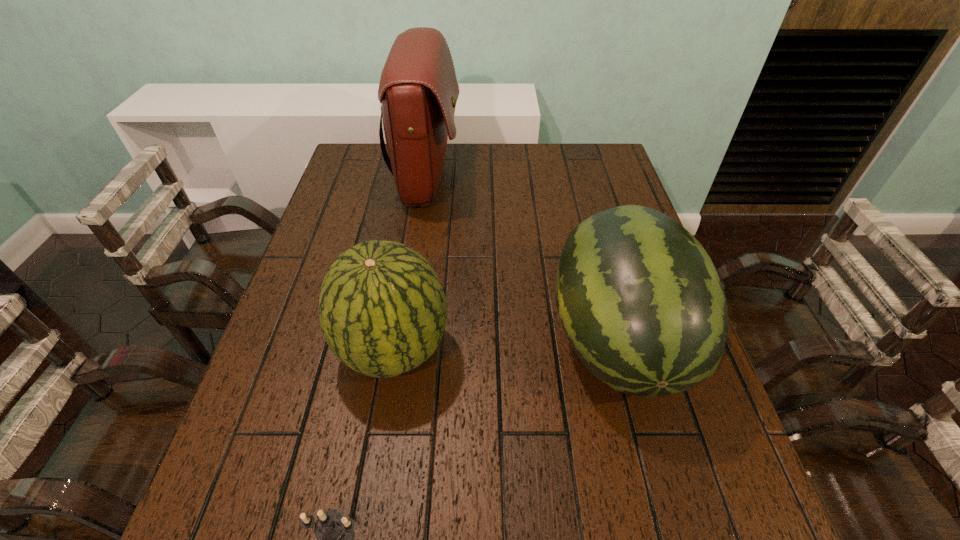
Where is `the tallest object`? The height and width of the screenshot is (540, 960). the tallest object is located at coordinates (418, 90).

At what (x,y) coordinates should I click in order to perform the action: click on the farthest object. Please return your answer as a coordinate pair (x, y). The height and width of the screenshot is (540, 960). Looking at the image, I should click on (418, 90).

Where is `the rightmost object`? the rightmost object is located at coordinates point(641,303).

Locate an element on the screen. the left watermelon is located at coordinates (382, 309).

This screenshot has height=540, width=960. In order to click on blank space located on the open flap of the tallest object in this screenshot , I will do `click(572, 178)`.

Identify the location of vacant area located on the front of the right watermelon. The image size is (960, 540). (654, 474).

I want to click on free location located 0.200m on the right of the left watermelon, so click(x=541, y=350).

Locate an element on the screen. Image resolution: width=960 pixels, height=540 pixels. object that is positioned at the far edge is located at coordinates (418, 90).

Identify the location of object located in the left edge section of the desktop. Image resolution: width=960 pixels, height=540 pixels. [x=382, y=309].

Locate an element on the screen. object present at the right edge is located at coordinates (641, 303).